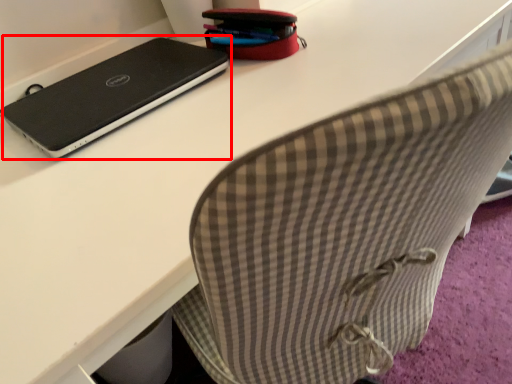
Question: From the image's perspective, what is the correct spatial positioning of laptop (annotated by the red box) in reference to pencil case?

Choices:
 (A) below
 (B) above

Answer: (A)